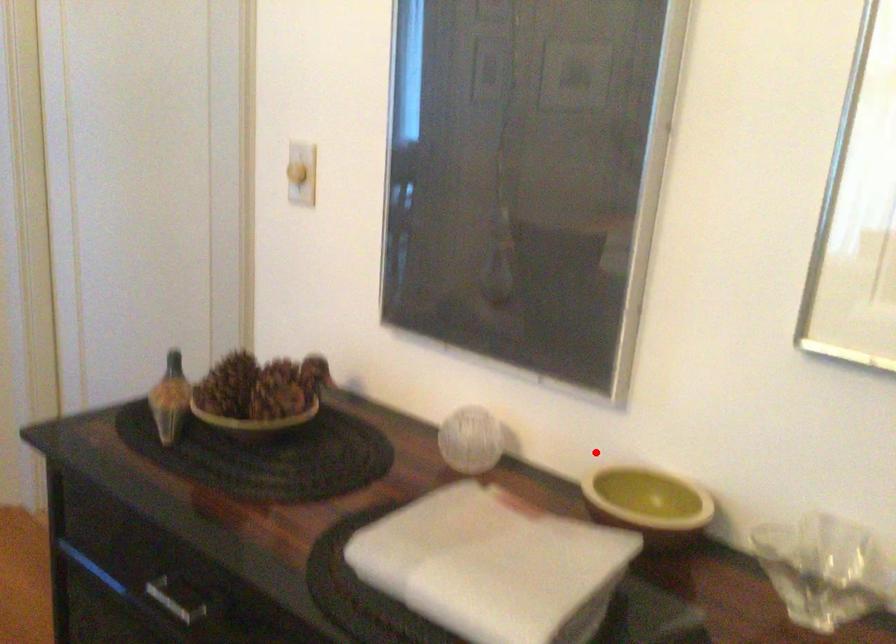
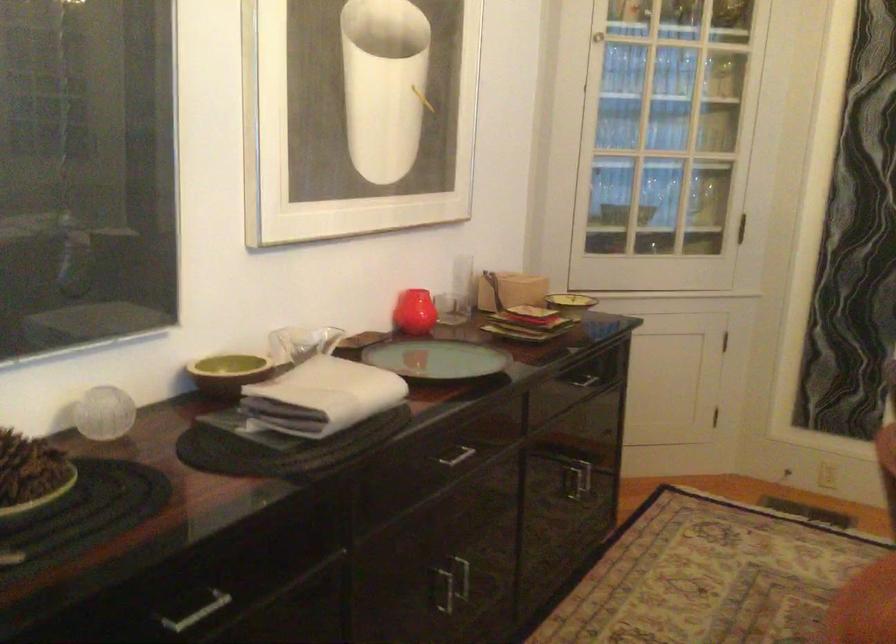
Where in the second image is the point corresponding to the highlighted location from the first image?

(228, 373)